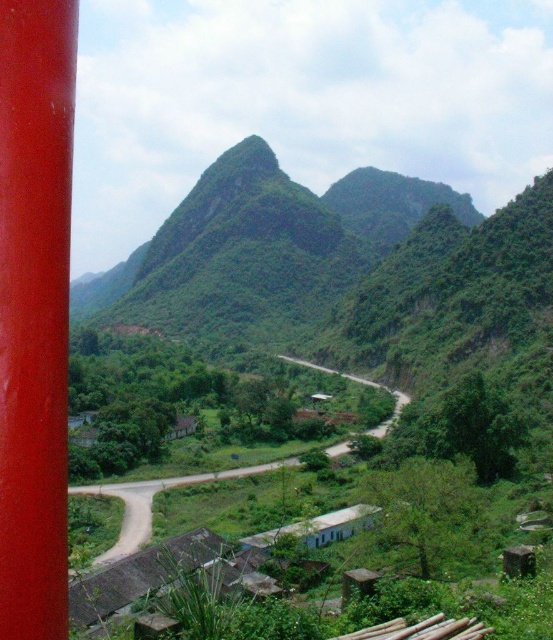
You are a hiker carrying a 100 foot long rope. You want to tie the glossy red pole at left to the green grassy road at center. Is the rope long enough to reach between them?

The glossy red pole at left and green grassy road at center are 92.09 feet apart from each other. Since the rope is 100 feet long, it is long enough to reach between them.

You are a hiker standing at the glossy red pole at left and want to walk to the green grassy road at center. Which direction should you head towards?

You should head towards the right to reach the green grassy road at center since the glossy red pole at left is to the left of it.